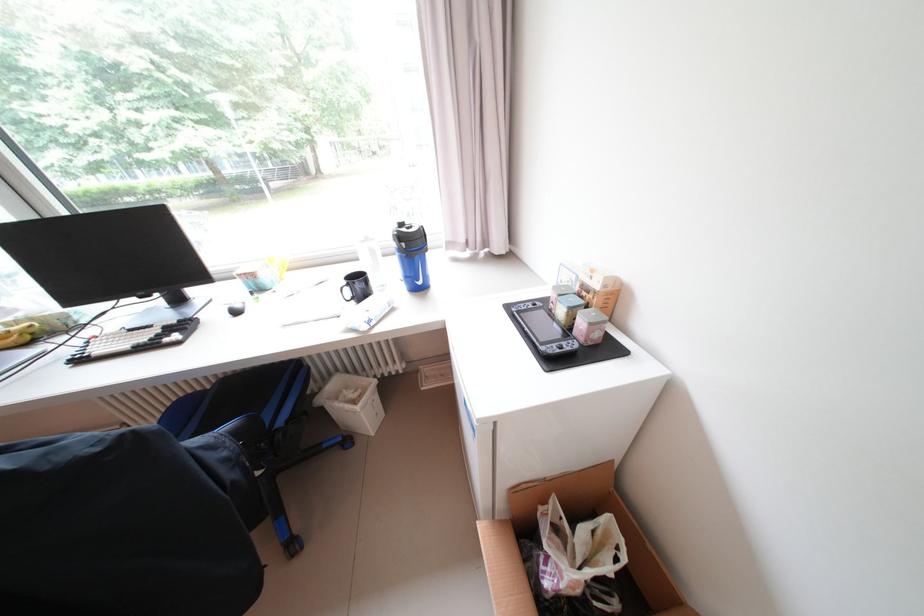
Where is `computer mouse`? This screenshot has height=616, width=924. computer mouse is located at coordinates (236, 309).